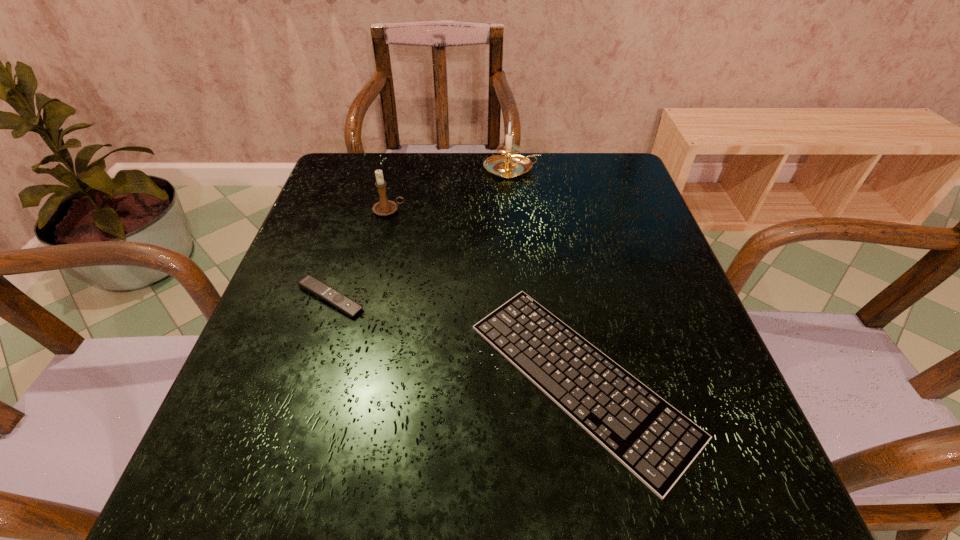
The image size is (960, 540). In order to click on vacant area that lies between the remote control and the taller candle holder in this screenshot , I will do `click(421, 233)`.

Image resolution: width=960 pixels, height=540 pixels. Find the location of `blank region between the third nearest object and the computer keyboard`. blank region between the third nearest object and the computer keyboard is located at coordinates (484, 295).

Where is `vacant space that's between the taller candle holder and the remote control`? vacant space that's between the taller candle holder and the remote control is located at coordinates (421, 233).

Locate which object ranks second in proximity to the remote control. Please provide its 2D coordinates. Your answer should be formatted as a tuple, i.e. [(x, y)], where the tuple contains the x and y coordinates of a point satisfying the conditions above.

[(652, 439)]

Find the location of `object identified as the closest to the left candle holder`. object identified as the closest to the left candle holder is located at coordinates (309, 283).

This screenshot has height=540, width=960. I want to click on free location that satisfies the following two spatial constraints: 1. on the handle side of the farther candle holder; 2. on the right side of the computer keyboard, so click(x=531, y=379).

Find the location of a particular element. Image resolution: width=960 pixels, height=540 pixels. vacant space that satisfies the following two spatial constraints: 1. on the side of the computer keyboard with the handle; 2. on the left side of the nearer candle holder is located at coordinates (348, 379).

Locate an element on the screen. The image size is (960, 540). vacant region that satisfies the following two spatial constraints: 1. on the side of the computer keyboard with the handle; 2. on the left side of the nearer candle holder is located at coordinates (348, 379).

Where is `free space in the image that satisfies the following two spatial constraints: 1. on the handle side of the taller candle holder; 2. on the front side of the remote control`? Image resolution: width=960 pixels, height=540 pixels. free space in the image that satisfies the following two spatial constraints: 1. on the handle side of the taller candle holder; 2. on the front side of the remote control is located at coordinates (524, 298).

At what (x,y) coordinates should I click in order to perform the action: click on free location that satisfies the following two spatial constraints: 1. on the handle side of the computer keyboard; 2. on the right side of the farther candle holder. Please return your answer as a coordinate pair (x, y). Looking at the image, I should click on (531, 379).